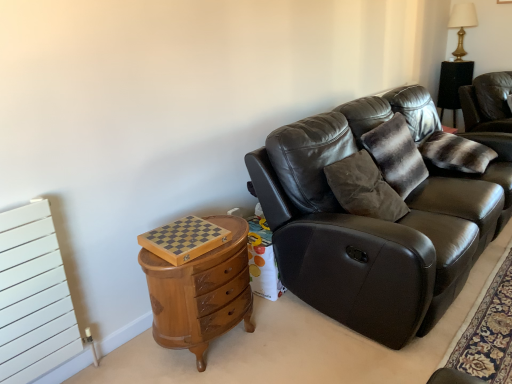
This screenshot has width=512, height=384. What do you see at coordinates (201, 292) in the screenshot?
I see `wooden chest of drawers at left` at bounding box center [201, 292].

I want to click on matte black leather couch at center, so click(x=349, y=234).

What are the coordinates of `leather couch at right` in the screenshot? It's located at (487, 103).

Locate an element on the screen. This screenshot has height=384, width=512. wooden chest of drawers at left is located at coordinates (201, 292).

Consider the image. Is wooden chest of drawers at left aimed at striped fur pillow at upper right?

No, wooden chest of drawers at left is not aimed at striped fur pillow at upper right.

Considering the sizes of objects wooden chest of drawers at left and striped fur pillow at upper right in the image provided, who is smaller, wooden chest of drawers at left or striped fur pillow at upper right?

striped fur pillow at upper right is smaller.

Is wooden chest of drawers at left positioned behind striped fur pillow at upper right?

No, wooden chest of drawers at left is closer to the viewer.

Considering the positions of objects gold metallic table lamp at upper right and wooden chest of drawers at left in the image provided, who is behind, gold metallic table lamp at upper right or wooden chest of drawers at left?

gold metallic table lamp at upper right is behind.

Considering the sizes of gold metallic table lamp at upper right and wooden chest of drawers at left in the image, is gold metallic table lamp at upper right bigger or smaller than wooden chest of drawers at left?

Clearly, gold metallic table lamp at upper right is smaller in size than wooden chest of drawers at left.

Would you say wooden chest of drawers at left is part of gold metallic table lamp at upper right's contents?

No, wooden chest of drawers at left is not inside gold metallic table lamp at upper right.

Considering the sizes of gold metallic table lamp at upper right and wooden chest of drawers at left in the image, is gold metallic table lamp at upper right wider or thinner than wooden chest of drawers at left?

In the image, gold metallic table lamp at upper right appears to be more narrow than wooden chest of drawers at left.

Can you confirm if wooden chest of drawers at left is positioned to the right of gold metallic table lamp at upper right?

No.

Identify the location of table lamp above the wooden chest of drawers at left (from a real-world perspective). (462, 25).

Considering the sizes of wooden chest of drawers at left and gold metallic table lamp at upper right in the image, is wooden chest of drawers at left taller or shorter than gold metallic table lamp at upper right?

Clearly, wooden chest of drawers at left is shorter compared to gold metallic table lamp at upper right.

Consider the image. Which point is more forward, (176, 312) or (451, 15)?

Positioned in front is point (176, 312).

Is leather couch at right bigger or smaller than striped fur pillow at upper right?

Clearly, leather couch at right is larger in size than striped fur pillow at upper right.

Based on the photo, are leather couch at right and striped fur pillow at upper right making contact?

No, leather couch at right is not next to striped fur pillow at upper right.

The width and height of the screenshot is (512, 384). What are the coordinates of `chair behind the striped fur pillow at upper right` in the screenshot? It's located at (487, 103).

Is leather couch at right further to the viewer compared to striped fur pillow at upper right?

Yes, leather couch at right is further from the viewer.

The height and width of the screenshot is (384, 512). Identify the location of pillow lying on the left of gold metallic table lamp at upper right. (456, 152).

Is gold metallic table lamp at upper right with striped fur pillow at upper right?

gold metallic table lamp at upper right and striped fur pillow at upper right are clearly separated.

Do you think gold metallic table lamp at upper right is within striped fur pillow at upper right, or outside of it?

gold metallic table lamp at upper right is not inside striped fur pillow at upper right, it's outside.

Between striped fur pillow at upper right and matte black leather couch at center, which one has more height?

Standing taller between the two is matte black leather couch at center.

What's the angular difference between striped fur pillow at upper right and matte black leather couch at center's facing directions?

1.97 degrees separate the facing orientations of striped fur pillow at upper right and matte black leather couch at center.

Would you say matte black leather couch at center is part of striped fur pillow at upper right's contents?

That's incorrect, matte black leather couch at center is not inside striped fur pillow at upper right.

Would you consider striped fur pillow at upper right to be distant from matte black leather couch at center?

No, there isn't a large distance between striped fur pillow at upper right and matte black leather couch at center.

Does point (464, 7) come closer to viewer compared to point (351, 327)?

No.

From the picture: Is there a large distance between gold metallic table lamp at upper right and matte black leather couch at center?

gold metallic table lamp at upper right is far away from matte black leather couch at center.

Locate an element on the screen. This screenshot has width=512, height=384. studio couch below the gold metallic table lamp at upper right (from a real-world perspective) is located at coordinates (349, 234).

Considering the positions of objects gold metallic table lamp at upper right and matte black leather couch at center in the image provided, who is more to the right, gold metallic table lamp at upper right or matte black leather couch at center?

gold metallic table lamp at upper right.

This screenshot has width=512, height=384. In the image, there is a striped fur pillow at upper right. Find the location of `the chest of drawers below it (from a real-world perspective)`. the chest of drawers below it (from a real-world perspective) is located at coordinates (201, 292).

The image size is (512, 384). I want to click on table lamp above the wooden chest of drawers at left (from the image's perspective), so click(462, 25).

Looking at this image, from the image, which object appears to be nearer to matte black leather couch at center, wooden chest of drawers at left or leather couch at right?

Among the two, wooden chest of drawers at left is located nearer to matte black leather couch at center.

Looking at this image, which object lies further to the anchor point gold metallic table lamp at upper right, matte black leather couch at center or striped fur pillow at upper right?

The object further to gold metallic table lamp at upper right is matte black leather couch at center.

Considering their positions, is leather couch at right positioned further to wooden chest of drawers at left than matte black leather couch at center?

The object further to wooden chest of drawers at left is leather couch at right.

Looking at this image, from the image, which object appears to be nearer to gold metallic table lamp at upper right, wooden chest of drawers at left or matte black leather couch at center?

matte black leather couch at center is closer to gold metallic table lamp at upper right.

Based on their spatial positions, is leather couch at right or striped fur pillow at upper right closer to gold metallic table lamp at upper right?

leather couch at right is closer to gold metallic table lamp at upper right.

Looking at the image, which one is located closer to leather couch at right, matte black leather couch at center or wooden chest of drawers at left?

matte black leather couch at center.

Considering their positions, is striped fur pillow at upper right positioned closer to matte black leather couch at center than gold metallic table lamp at upper right?

Based on the image, striped fur pillow at upper right appears to be nearer to matte black leather couch at center.

Estimate the real-world distances between objects in this image. Which object is closer to leather couch at right, wooden chest of drawers at left or gold metallic table lamp at upper right?

Among the two, gold metallic table lamp at upper right is located nearer to leather couch at right.

Identify the location of studio couch between wooden chest of drawers at left and striped fur pillow at upper right in the horizontal direction. This screenshot has width=512, height=384. (349, 234).

Identify the location of studio couch between wooden chest of drawers at left and leather couch at right in the horizontal direction. (349, 234).

The height and width of the screenshot is (384, 512). Find the location of `pillow between matte black leather couch at center and leather couch at right in the front-back direction`. pillow between matte black leather couch at center and leather couch at right in the front-back direction is located at coordinates (456, 152).

The image size is (512, 384). What are the coordinates of `chair between striped fur pillow at upper right and gold metallic table lamp at upper right from front to back` in the screenshot? It's located at (487, 103).